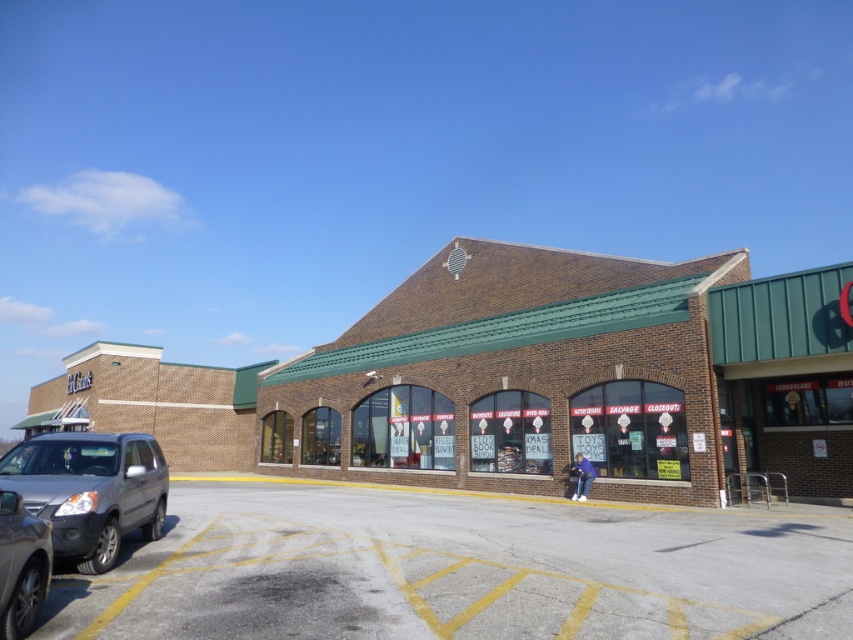
Who is taller, gray asphalt parking lot at lower left or matte gray suv at lower left?

gray asphalt parking lot at lower left is taller.

Is gray asphalt parking lot at lower left thinner than matte gray suv at lower left?

No, gray asphalt parking lot at lower left is not thinner than matte gray suv at lower left.

Who is more forward, (144, 634) or (146, 435)?

Point (144, 634) is more forward.

The image size is (853, 640). What are the coordinates of `gray asphalt parking lot at lower left` in the screenshot? It's located at (460, 570).

Does point (535, 513) lie in front of point (28, 513)?

That is False.

Looking at this image, which of these two, gray asphalt parking lot at lower left or satin silver sedan at lower left, stands shorter?

With less height is satin silver sedan at lower left.

Is point (399, 632) positioned behind point (4, 596)?

Yes, it is behind point (4, 596).

The image size is (853, 640). Identify the location of gray asphalt parking lot at lower left. (460, 570).

Between matte gray suv at lower left and satin silver sedan at lower left, which one is positioned lower?

matte gray suv at lower left is lower down.

Does matte gray suv at lower left have a lesser width compared to satin silver sedan at lower left?

Incorrect, matte gray suv at lower left's width is not less than satin silver sedan at lower left's.

Describe the element at coordinates (90, 490) in the screenshot. I see `matte gray suv at lower left` at that location.

Find the location of a particular element. matte gray suv at lower left is located at coordinates (90, 490).